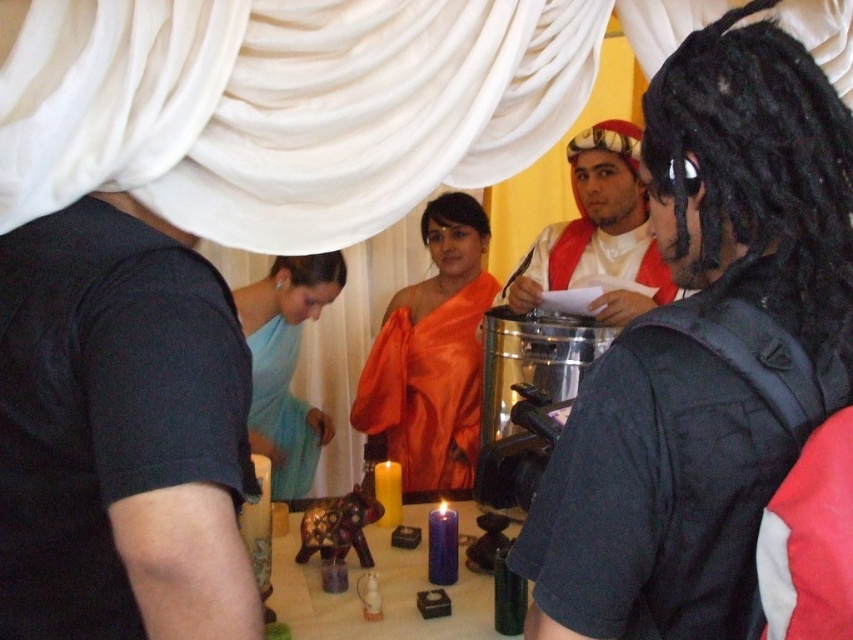
Question: Based on their relative distances, which object is farther from the light blue silk dress at center?

Choices:
 (A) matte red fabric at center
 (B) satin orange dress at center
 (C) white silk robe at center

Answer: (A)

Question: Can you confirm if black fabric robe at right is positioned to the right of white silk robe at center?

Choices:
 (A) yes
 (B) no

Answer: (B)

Question: Which point is closer to the camera?

Choices:
 (A) black cotton t-shirt at left
 (B) light blue silk dress at center
 (C) black fabric robe at right

Answer: (C)

Question: Estimate the real-world distances between objects in this image. Which object is farther from the black fabric robe at right?

Choices:
 (A) white silk robe at center
 (B) light blue silk dress at center

Answer: (B)

Question: Does black fabric robe at right appear over satin orange dress at center?

Choices:
 (A) yes
 (B) no

Answer: (A)

Question: Can you confirm if black fabric robe at right is positioned below satin orange dress at center?

Choices:
 (A) yes
 (B) no

Answer: (B)